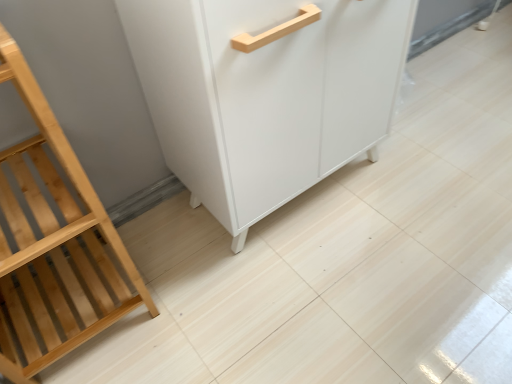
Question: From a real-world perspective, is natural wood shelf at left physically located above or below white matte cabinet at center?

Choices:
 (A) above
 (B) below

Answer: (A)

Question: Looking at the image, does natural wood shelf at left seem bigger or smaller compared to white matte cabinet at center?

Choices:
 (A) small
 (B) big

Answer: (A)

Question: From their relative heights in the image, would you say natural wood shelf at left is taller or shorter than white matte cabinet at center?

Choices:
 (A) short
 (B) tall

Answer: (B)

Question: Is white matte cabinet at center bigger or smaller than natural wood shelf at left?

Choices:
 (A) small
 (B) big

Answer: (B)

Question: Is white matte cabinet at center situated inside natural wood shelf at left or outside?

Choices:
 (A) inside
 (B) outside

Answer: (B)

Question: Considering their positions, is white matte cabinet at center located in front of or behind natural wood shelf at left?

Choices:
 (A) front
 (B) behind

Answer: (B)

Question: From a real-world perspective, is white matte cabinet at center above or below natural wood shelf at left?

Choices:
 (A) below
 (B) above

Answer: (A)